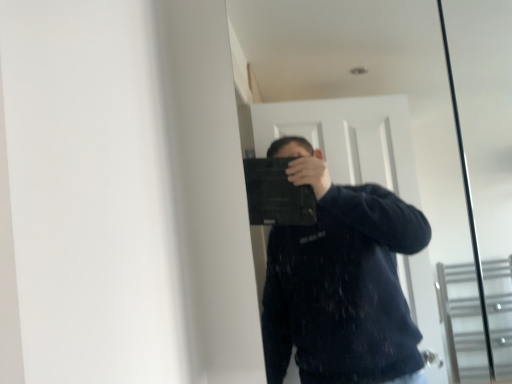
The width and height of the screenshot is (512, 384). I want to click on black matte laptop at center, so click(x=340, y=48).

This screenshot has height=384, width=512. What do you see at coordinates (340, 48) in the screenshot?
I see `black matte laptop at center` at bounding box center [340, 48].

What is the approximate height of black matte laptop at center?

It is 26.85 inches.

Locate an element on the screen. black matte laptop at center is located at coordinates (340, 48).